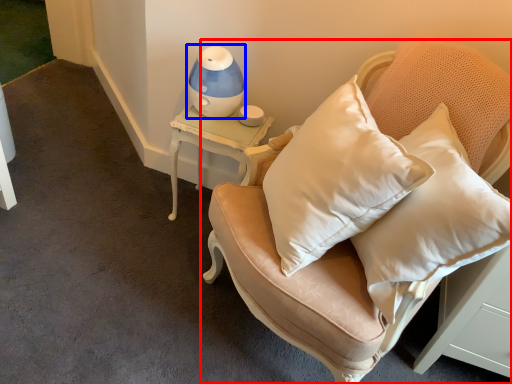
Question: Which point is closer to the camera, furniture (highlighted by a red box) or table lamp (highlighted by a blue box)?

Choices:
 (A) furniture
 (B) table lamp

Answer: (A)